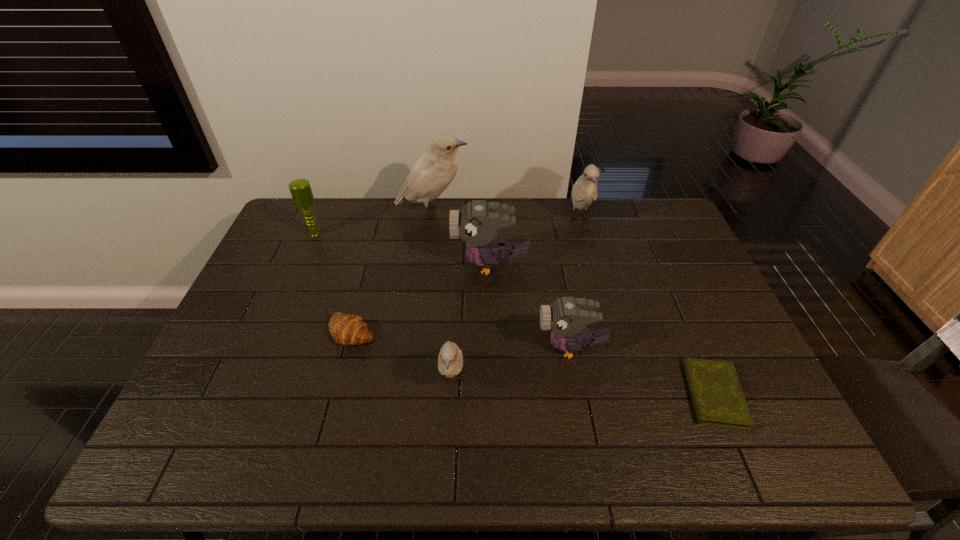
Where is `the tallest object`? The height and width of the screenshot is (540, 960). the tallest object is located at coordinates (433, 172).

Find the location of a particular element. the tallest bird is located at coordinates (433, 172).

What are the coordinates of `the rightmost white bird` in the screenshot? It's located at (584, 191).

Find the location of a particular element. The image size is (960, 540). the third nearest bird is located at coordinates (477, 223).

Locate an element on the screen. the farther gray bird is located at coordinates (477, 223).

You are a GUI agent. You are given a task and a screenshot of the screen. Output one action in this format:
    pyautogui.click(x=<x>, y=<y>)
    Task: Click on the microphone
    This screenshot has width=960, height=540.
    Given the screenshot: What is the action you would take?
    click(300, 189)

Image resolution: width=960 pixels, height=540 pixels. What are the coordinates of `the smallest white bird` in the screenshot? It's located at (450, 361).

Identify the location of the nearer gray bird. (566, 317).

Identify the location of brown crescent roll. (346, 329).

I want to click on the seventh tallest object, so click(x=346, y=329).